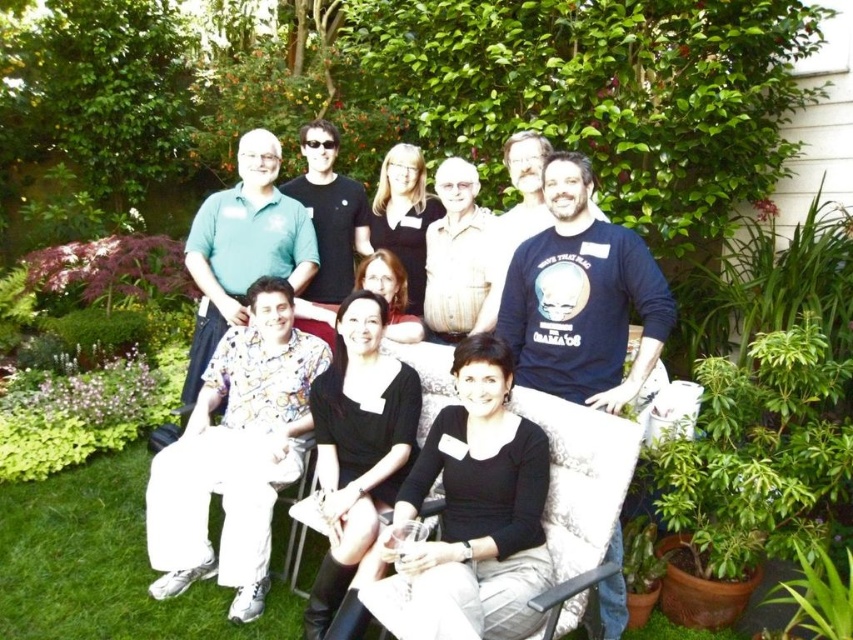
You are taking a photo of the group and need to adjust the focus to ensure both the green cotton shirt at upper left and the light brown textured shirt at center are visible. Which shirt should you focus on first to make sure both are in frame?

The green cotton shirt at upper left is positioned under the light brown textured shirt at center, so you should focus on the light brown textured shirt at center first to ensure both are visible in the frame.